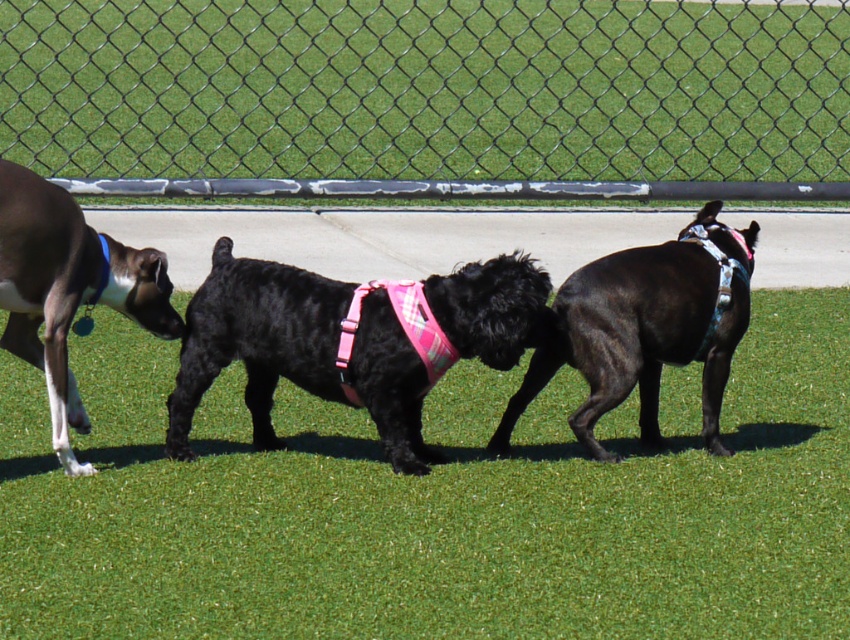
Question: Which object appears farthest from the camera in this image?

Choices:
 (A) chain-link fence at center
 (B) shiny black dog at center

Answer: (A)

Question: Which point is closer to the camera taking this photo?

Choices:
 (A) (686, 301)
 (B) (737, 452)
 (C) (292, 356)

Answer: (C)

Question: Is chain-link fence at center positioned behind shiny black dog at center?

Choices:
 (A) no
 (B) yes

Answer: (B)

Question: Where is green grass at center located in relation to smooth brown dog at left in the image?

Choices:
 (A) right
 (B) left

Answer: (A)

Question: Does shiny black dog at center appear under smooth brown dog at left?

Choices:
 (A) no
 (B) yes

Answer: (B)

Question: Which object is the farthest from the chain-link fence at center?

Choices:
 (A) black fabric dog at center
 (B) smooth brown dog at left
 (C) shiny black dog at center
 (D) green grass at center

Answer: (C)